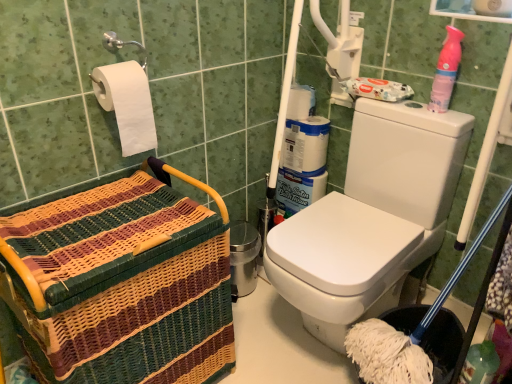
In order to click on vacant region in front of pink plastic spray bottle at upper right in this screenshot , I will do `click(444, 119)`.